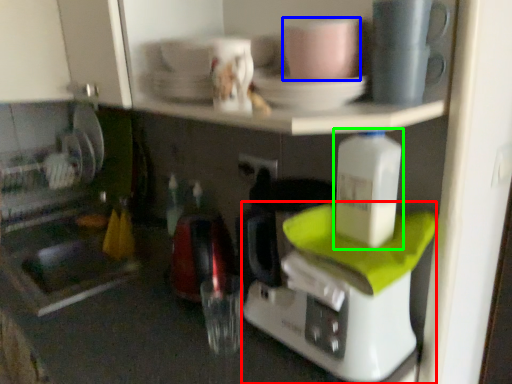
Question: Which object is positioned farthest from coffee maker (highlighted by a red box)? Select from coffee cup (highlighted by a blue box) and bottle (highlighted by a green box).

Choices:
 (A) coffee cup
 (B) bottle

Answer: (A)